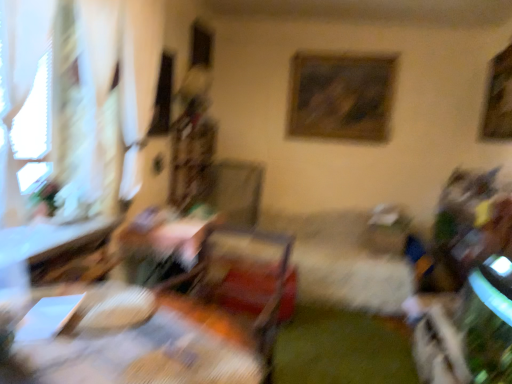
Image resolution: width=512 pixels, height=384 pixels. Find the location of `wooden table at left, the first table in the back-to-front sequence`. wooden table at left, the first table in the back-to-front sequence is located at coordinates (44, 245).

In order to face wooden table at center, marked as the second table in a back-to-front arrangement, should I rotate leftwards or rightwards?

To align with it, rotate left about 20.122°.

Describe the element at coordinates (131, 342) in the screenshot. I see `wooden table at center, marked as the second table in a back-to-front arrangement` at that location.

This screenshot has height=384, width=512. What do you see at coordinates (23, 100) in the screenshot?
I see `white sheer curtain at left` at bounding box center [23, 100].

This screenshot has height=384, width=512. I want to click on wooden swivel chair at center, so click(251, 284).

From the picture: From the image's perspective, is wooden table at left, the first table in the back-to-front sequence, positioned above or below white sheer curtain at left?

Based on their image positions, wooden table at left, the first table in the back-to-front sequence, is located beneath white sheer curtain at left.

In the scene shown: Is white sheer curtain at left inside wooden table at left, the 2th table when ordered from front to back?

Definitely not — white sheer curtain at left is not inside wooden table at left, the 2th table when ordered from front to back.

Based on the photo, measure the distance between wooden table at left, the first table in the back-to-front sequence, and white sheer curtain at left.

wooden table at left, the first table in the back-to-front sequence, is 37.07 centimeters from white sheer curtain at left.

Which is behind, point (3, 257) or point (17, 138)?

The point (17, 138) is farther from the camera.

Is white sheer curtain at left shorter than white sheer curtain at left?

Yes.

From the image's perspective, which one is positioned lower, white sheer curtain at left or white sheer curtain at left?

white sheer curtain at left.

Would you say white sheer curtain at left contains white sheer curtain at left?

That's incorrect, white sheer curtain at left is not inside white sheer curtain at left.

Which is more distant, (50, 97) or (154, 73)?

The point (154, 73) is farther from the camera.

From the image's perspective, does wooden swivel chair at center appear lower than wooden table at left, the first table in the back-to-front sequence?

Yes, from the image's perspective, wooden swivel chair at center is below wooden table at left, the first table in the back-to-front sequence.

Is point (268, 293) positioned in front of point (0, 255)?

No.

Which object is further away from the camera taking this photo, wooden swivel chair at center or wooden table at left, the 2th table when ordered from front to back?

Positioned behind is wooden table at left, the 2th table when ordered from front to back.

Is wooden table at center, marked as the second table in a back-to-front arrangement, smaller than wooden framed painting at upper center, the 2th picture frame from the right?

No, wooden table at center, marked as the second table in a back-to-front arrangement, is not smaller than wooden framed painting at upper center, the 2th picture frame from the right.

Which is nearer, (213, 365) or (329, 87)?

Clearly, point (213, 365) is closer to the camera than point (329, 87).

Considering the relative positions of wooden table at center, placed as the 1th table when sorted from front to back, and wooden framed painting at upper center, acting as the 1th picture frame starting from the back, in the image provided, is wooden table at center, placed as the 1th table when sorted from front to back, in front of wooden framed painting at upper center, acting as the 1th picture frame starting from the back,?

Yes, wooden table at center, placed as the 1th table when sorted from front to back, is in front of wooden framed painting at upper center, acting as the 1th picture frame starting from the back.

Is wooden table at center, placed as the 1th table when sorted from front to back, directly adjacent to wooden framed painting at upper center, acting as the 1th picture frame starting from the back?

No.

Between wooden table at left, the 2th table when ordered from front to back, and wooden swivel chair at center, which one has larger size?

wooden swivel chair at center.

Which of these two, wooden table at left, the 2th table when ordered from front to back, or wooden swivel chair at center, stands shorter?

wooden table at left, the 2th table when ordered from front to back.

Is wooden table at left, the 2th table when ordered from front to back, spatially inside wooden swivel chair at center, or outside of it?

wooden table at left, the 2th table when ordered from front to back, is not enclosed by wooden swivel chair at center.

How distant is wooden table at left, the first table in the back-to-front sequence, from wooden swivel chair at center?

A distance of 37.20 inches exists between wooden table at left, the first table in the back-to-front sequence, and wooden swivel chair at center.

Where is `table on the right of wooden table at left, the first table in the back-to-front sequence`? table on the right of wooden table at left, the first table in the back-to-front sequence is located at coordinates (131, 342).

From the image's perspective, relative to wooden table at left, the 2th table when ordered from front to back, is wooden table at center, marked as the second table in a back-to-front arrangement, above or below?

Based on their image positions, wooden table at center, marked as the second table in a back-to-front arrangement, is located beneath wooden table at left, the 2th table when ordered from front to back.

Considering the positions of point (244, 376) and point (32, 260), is point (244, 376) closer or farther from the camera than point (32, 260)?

Point (244, 376) is closer to the camera than point (32, 260).

Does wooden table at center, placed as the 1th table when sorted from front to back, have a lesser height compared to wooden table at left, the first table in the back-to-front sequence?

Incorrect, the height of wooden table at center, placed as the 1th table when sorted from front to back, does not fall short of that of wooden table at left, the first table in the back-to-front sequence.

Between wooden table at center, placed as the 1th table when sorted from front to back, and wooden framed picture at upper right, which is the 1th picture frame in front-to-back order, which one has larger size?

With larger size is wooden table at center, placed as the 1th table when sorted from front to back.

Does wooden table at center, placed as the 1th table when sorted from front to back, touch wooden framed picture at upper right, the 2th picture frame viewed from the left?

No.

Is point (9, 374) farther from viewer compared to point (511, 66)?

No.

From the image's perspective, starting from the white sheer curtain at left, which table is the 1st one below? Please provide its 2D coordinates.

[(44, 245)]

The image size is (512, 384). In the image, there is a white sheer curtain at left. In order to click on window below it (from a real-world perspective) in this screenshot , I will do `click(23, 100)`.

Which object lies nearer to the anchor point white sheer curtain at left, white sheer curtain at left or wooden swivel chair at center?

white sheer curtain at left is closer to white sheer curtain at left.

Which object lies nearer to the anchor point wooden swivel chair at center, wooden framed picture at upper right, the 2th picture frame viewed from the left, or white sheer curtain at left?

white sheer curtain at left.

Based on their spatial positions, is wooden framed painting at upper center, the 2th picture frame from the right, or white sheer curtain at left further from white sheer curtain at left?

wooden framed painting at upper center, the 2th picture frame from the right, is positioned further to the anchor white sheer curtain at left.

Which object lies further to the anchor point white sheer curtain at left, wooden table at left, the first table in the back-to-front sequence, or wooden framed picture at upper right, the second picture frame in the back-to-front sequence?

wooden framed picture at upper right, the second picture frame in the back-to-front sequence, is positioned further to the anchor white sheer curtain at left.

Based on their spatial positions, is wooden framed picture at upper right, the second picture frame in the back-to-front sequence, or white sheer curtain at left closer to wooden table at center, placed as the 1th table when sorted from front to back?

white sheer curtain at left.

When comparing their distances from wooden table at center, placed as the 1th table when sorted from front to back, does wooden swivel chair at center or white sheer curtain at left seem further?

The object further to wooden table at center, placed as the 1th table when sorted from front to back, is white sheer curtain at left.

Estimate the real-world distances between objects in this image. Which object is closer to white sheer curtain at left, wooden framed painting at upper center, acting as the 1th picture frame starting from the back, or wooden table at left, the first table in the back-to-front sequence?

wooden table at left, the first table in the back-to-front sequence, is positioned closer to the anchor white sheer curtain at left.

Estimate the real-world distances between objects in this image. Which object is further from wooden table at left, the 2th table when ordered from front to back, white sheer curtain at left or white sheer curtain at left?

Among the two, white sheer curtain at left is located further to wooden table at left, the 2th table when ordered from front to back.

What are the coordinates of `window between wooden table at center, placed as the 1th table when sorted from front to back, and wooden table at left, the 2th table when ordered from front to back, from front to back` in the screenshot? It's located at (23, 100).

Identify the location of picture frame located between wooden swivel chair at center and wooden framed painting at upper center, the 2th picture frame from the right, in the depth direction. The height and width of the screenshot is (384, 512). (498, 99).

Locate an element on the screen. table between white sheer curtain at left and wooden swivel chair at center vertically is located at coordinates (44, 245).

Where is `window between wooden table at center, placed as the 1th table when sorted from front to back, and wooden framed painting at upper center, the first picture frame from the left, from front to back`? window between wooden table at center, placed as the 1th table when sorted from front to back, and wooden framed painting at upper center, the first picture frame from the left, from front to back is located at coordinates (23, 100).